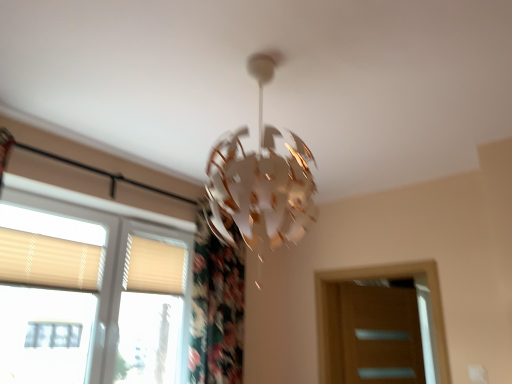
In order to face brown wooden screen door at lower right, should I rotate leftwards or rightwards?

Turn right by 16.419 degrees to look at brown wooden screen door at lower right.

This screenshot has height=384, width=512. What do you see at coordinates (49, 261) in the screenshot?
I see `beige fabric shutter at left, the 2th shutter when ordered from back to front` at bounding box center [49, 261].

Where is `brown wooden screen door at lower right`? This screenshot has width=512, height=384. brown wooden screen door at lower right is located at coordinates (381, 335).

How different are the orientations of beige fabric shutter at lower left, the 1th shutter in the back-to-front sequence, and beige textured blinds at left in degrees?

0.000147 degrees separate the facing orientations of beige fabric shutter at lower left, the 1th shutter in the back-to-front sequence, and beige textured blinds at left.

In the scene shown: Between beige fabric shutter at lower left, the 1th shutter in the back-to-front sequence, and beige textured blinds at left, which one has smaller size?

beige fabric shutter at lower left, the 1th shutter in the back-to-front sequence, is smaller.

Are beige fabric shutter at lower left, the 1th shutter in the back-to-front sequence, and beige textured blinds at left far apart?

They are positioned close to each other.

How far apart are beige fabric shutter at lower left, the second shutter positioned from the front, and beige textured blinds at left?

beige fabric shutter at lower left, the second shutter positioned from the front, is 9.89 inches from beige textured blinds at left.

Where is `window to the right of beige fabric shutter at left, the 2th shutter when ordered from back to front`? window to the right of beige fabric shutter at left, the 2th shutter when ordered from back to front is located at coordinates (89, 292).

In the scene shown: Is beige fabric shutter at left, acting as the second shutter starting from the right, looking in the opposite direction of beige textured blinds at left?

Yes, beige fabric shutter at left, acting as the second shutter starting from the right,'s orientation is away from beige textured blinds at left.

From the image's perspective, is beige fabric shutter at left, acting as the second shutter starting from the right, below beige textured blinds at left?

No, from the image's perspective, beige fabric shutter at left, acting as the second shutter starting from the right, is not below beige textured blinds at left.

Between beige fabric shutter at left, the 1th shutter viewed from the left, and beige textured blinds at left, which one has larger width?

With larger width is beige textured blinds at left.

Does beige fabric shutter at lower left, the first shutter in the right-to-left sequence, turn towards brown wooden screen door at lower right?

No, beige fabric shutter at lower left, the first shutter in the right-to-left sequence, is not turned towards brown wooden screen door at lower right.

The image size is (512, 384). I want to click on the 2nd shutter above the brown wooden screen door at lower right (from a real-world perspective), so click(154, 266).

Looking at their sizes, would you say beige fabric shutter at lower left, the second shutter positioned from the front, is wider or thinner than brown wooden screen door at lower right?

In the image, beige fabric shutter at lower left, the second shutter positioned from the front, appears to be more narrow than brown wooden screen door at lower right.

At what (x,y) coordinates should I click in order to perform the action: click on window below the beige fabric shutter at lower left, the second shutter positioned from the front (from a real-world perspective). Please return your answer as a coordinate pair (x, y). The height and width of the screenshot is (384, 512). Looking at the image, I should click on (89, 292).

Choose the correct answer: Is beige textured blinds at left inside beige fabric shutter at lower left, the second shutter positioned from the front, or outside it?

beige textured blinds at left lies outside beige fabric shutter at lower left, the second shutter positioned from the front.

Considering the relative sizes of beige textured blinds at left and beige fabric shutter at lower left, the 1th shutter in the back-to-front sequence, in the image provided, is beige textured blinds at left thinner than beige fabric shutter at lower left, the 1th shutter in the back-to-front sequence,?

In fact, beige textured blinds at left might be wider than beige fabric shutter at lower left, the 1th shutter in the back-to-front sequence.

Does beige textured blinds at left have a larger size compared to brown wooden screen door at lower right?

Yes.

From a real-world perspective, does beige textured blinds at left sit lower than brown wooden screen door at lower right?

Actually, beige textured blinds at left is physically above brown wooden screen door at lower right in the real world.

At what (x,y) coordinates should I click in order to perform the action: click on screen door below the beige textured blinds at left (from a real-world perspective). Please return your answer as a coordinate pair (x, y). This screenshot has height=384, width=512. Looking at the image, I should click on (381, 335).

Considering the positions of point (68, 197) and point (355, 289), is point (68, 197) closer or farther from the camera than point (355, 289)?

Point (68, 197) is positioned closer to the camera compared to point (355, 289).

From a real-world perspective, is beige fabric shutter at left, acting as the second shutter starting from the right, on beige fabric shutter at lower left, the first shutter in the right-to-left sequence?

Incorrect, from a real-world perspective, beige fabric shutter at left, acting as the second shutter starting from the right, is lower than beige fabric shutter at lower left, the first shutter in the right-to-left sequence.

The height and width of the screenshot is (384, 512). Find the location of `shutter located on the left of beige fabric shutter at lower left, positioned as the 2th shutter in left-to-right order`. shutter located on the left of beige fabric shutter at lower left, positioned as the 2th shutter in left-to-right order is located at coordinates (49, 261).

Which of these two, beige fabric shutter at left, acting as the second shutter starting from the right, or beige fabric shutter at lower left, the first shutter in the right-to-left sequence, stands taller?

With more height is beige fabric shutter at lower left, the first shutter in the right-to-left sequence.

Which is behind, point (355, 310) or point (12, 234)?

The point (355, 310) is farther.

Can you confirm if brown wooden screen door at lower right is wider than beige fabric shutter at left, the 2th shutter when ordered from back to front?

Correct, the width of brown wooden screen door at lower right exceeds that of beige fabric shutter at left, the 2th shutter when ordered from back to front.

Is brown wooden screen door at lower right to the right of beige fabric shutter at left, the 1th shutter viewed from the left, from the viewer's perspective?

Indeed, brown wooden screen door at lower right is positioned on the right side of beige fabric shutter at left, the 1th shutter viewed from the left.

Is brown wooden screen door at lower right surrounding beige fabric shutter at left, acting as the second shutter starting from the right?

No, beige fabric shutter at left, acting as the second shutter starting from the right, is located outside of brown wooden screen door at lower right.

The width and height of the screenshot is (512, 384). Identify the location of the 1st shutter above when counting from the beige textured blinds at left (from the image's perspective). (154, 266).

The image size is (512, 384). I want to click on the 1st shutter behind when counting from the beige textured blinds at left, so click(x=49, y=261).

Considering their positions, is beige textured blinds at left positioned further to brown wooden screen door at lower right than beige fabric shutter at left, the 2th shutter when ordered from back to front?

Based on the image, beige fabric shutter at left, the 2th shutter when ordered from back to front, appears to be further to brown wooden screen door at lower right.

Looking at the image, which one is located closer to beige fabric shutter at lower left, positioned as the 2th shutter in left-to-right order, brown wooden screen door at lower right or beige fabric shutter at left, acting as the second shutter starting from the right?

Based on the image, beige fabric shutter at left, acting as the second shutter starting from the right, appears to be nearer to beige fabric shutter at lower left, positioned as the 2th shutter in left-to-right order.

Estimate the real-world distances between objects in this image. Which object is further from beige textured blinds at left, brown wooden screen door at lower right or beige fabric shutter at left, the 1th shutter viewed from the front?

Based on the image, brown wooden screen door at lower right appears to be further to beige textured blinds at left.

Based on their spatial positions, is beige textured blinds at left or brown wooden screen door at lower right closer to beige fabric shutter at lower left, positioned as the 2th shutter in left-to-right order?

The object closer to beige fabric shutter at lower left, positioned as the 2th shutter in left-to-right order, is beige textured blinds at left.

Looking at the image, which one is located closer to brown wooden screen door at lower right, beige fabric shutter at left, the 1th shutter viewed from the front, or beige textured blinds at left?

beige textured blinds at left is closer to brown wooden screen door at lower right.

Which object lies further to the anchor point beige textured blinds at left, beige fabric shutter at left, acting as the second shutter starting from the right, or beige fabric shutter at lower left, the 1th shutter in the back-to-front sequence?

Among the two, beige fabric shutter at lower left, the 1th shutter in the back-to-front sequence, is located further to beige textured blinds at left.

Based on their spatial positions, is beige fabric shutter at left, acting as the second shutter starting from the right, or beige fabric shutter at lower left, the first shutter in the right-to-left sequence, further from brown wooden screen door at lower right?

Based on the image, beige fabric shutter at left, acting as the second shutter starting from the right, appears to be further to brown wooden screen door at lower right.

Looking at the image, which one is located closer to brown wooden screen door at lower right, beige textured blinds at left or beige fabric shutter at lower left, the first shutter in the right-to-left sequence?

beige fabric shutter at lower left, the first shutter in the right-to-left sequence, lies closer to brown wooden screen door at lower right than the other object.

You are a GUI agent. You are given a task and a screenshot of the screen. Output one action in this format:
    pyautogui.click(x=<x>, y=<y>)
    Task: Click on the shutter positioned between beige textured blinds at left and beige fabric shutter at lower left, the 1th shutter in the back-to-front sequence, from near to far
    The height and width of the screenshot is (384, 512).
    Given the screenshot: What is the action you would take?
    pyautogui.click(x=49, y=261)

Locate an element on the screen. shutter located between beige textured blinds at left and brown wooden screen door at lower right in the left-right direction is located at coordinates (154, 266).

At what (x,y) coordinates should I click in order to perform the action: click on window between beige fabric shutter at left, the 1th shutter viewed from the front, and brown wooden screen door at lower right from left to right. Please return your answer as a coordinate pair (x, y). Looking at the image, I should click on (89, 292).

Locate an element on the screen. The height and width of the screenshot is (384, 512). shutter between beige fabric shutter at left, the 2th shutter when ordered from back to front, and brown wooden screen door at lower right is located at coordinates (154, 266).